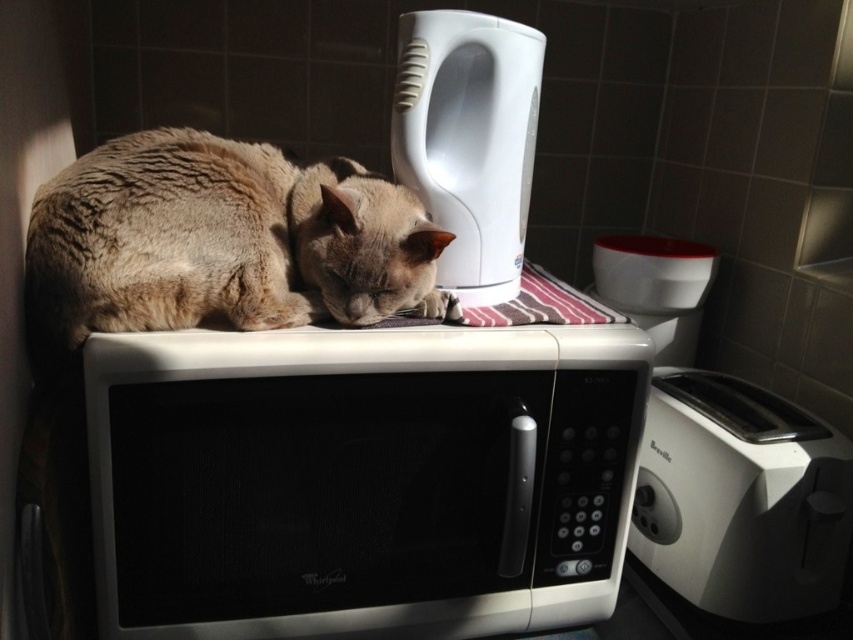
Which of these two, fuzzy fur cat at upper left or white glossy electric kettle at upper right, stands taller?

Standing taller between the two is white glossy electric kettle at upper right.

Where is `fuzzy fur cat at upper left`? fuzzy fur cat at upper left is located at coordinates (219, 241).

Does point (47, 225) come closer to viewer compared to point (498, 280)?

That is True.

The width and height of the screenshot is (853, 640). Identify the location of fuzzy fur cat at upper left. (219, 241).

Does point (560, 378) come behind point (70, 244)?

Yes, it is.

Between white matte microwave at upper center and fuzzy fur cat at upper left, which one is positioned lower?

white matte microwave at upper center is lower down.

Which is behind, point (405, 352) or point (90, 316)?

The point (405, 352) is more distant.

Where is `white matte microwave at upper center`? Image resolution: width=853 pixels, height=640 pixels. white matte microwave at upper center is located at coordinates (363, 480).

Who is positioned more to the left, fuzzy fur cat at upper left or white plastic toaster at right?

From the viewer's perspective, fuzzy fur cat at upper left appears more on the left side.

Is fuzzy fur cat at upper left positioned behind white plastic toaster at right?

No, fuzzy fur cat at upper left is in front of white plastic toaster at right.

Between point (289, 291) and point (735, 618), which one is positioned behind?

Point (735, 618)

Where is `fuzzy fur cat at upper left`? The height and width of the screenshot is (640, 853). fuzzy fur cat at upper left is located at coordinates (219, 241).